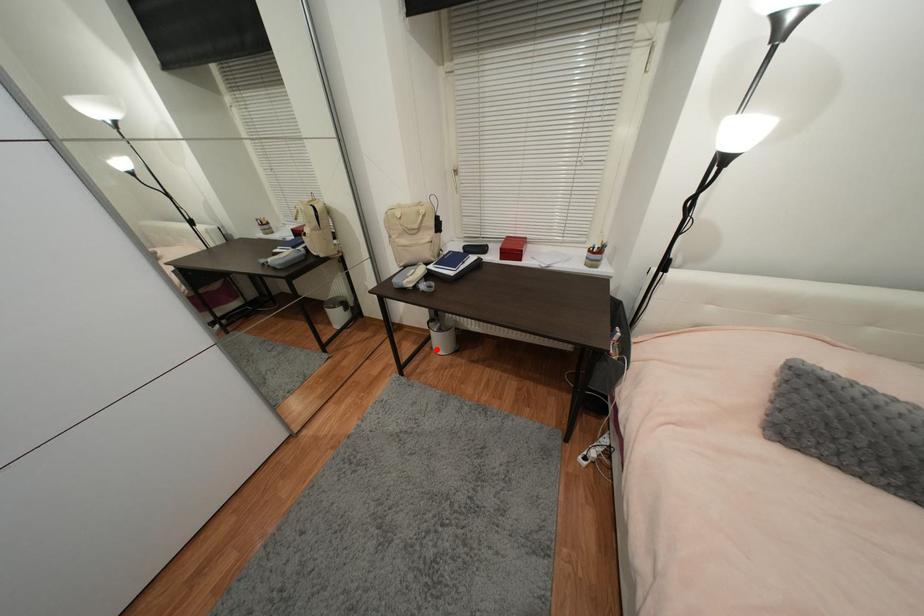
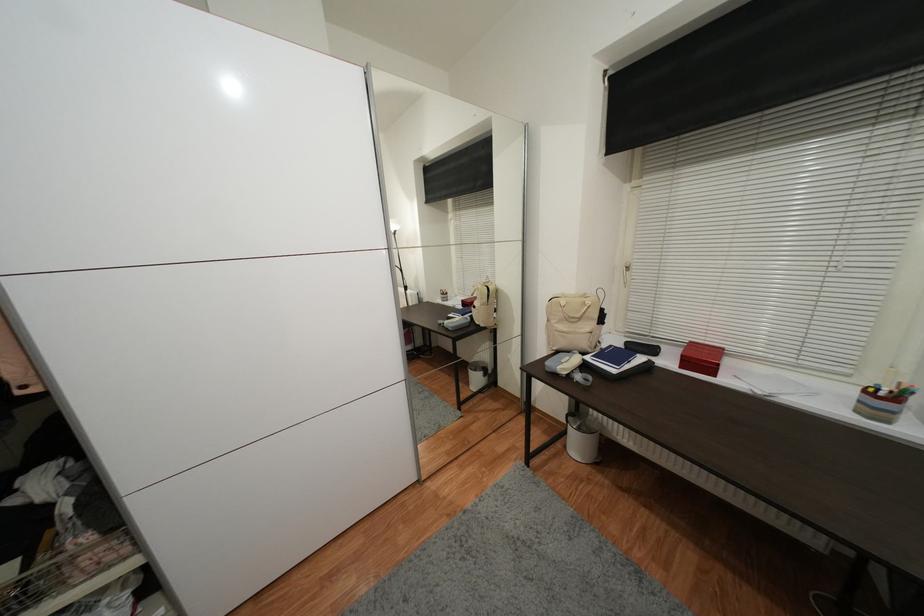
The point at the highlighted location is marked in the first image. Where is the corresponding point in the second image?

(569, 448)